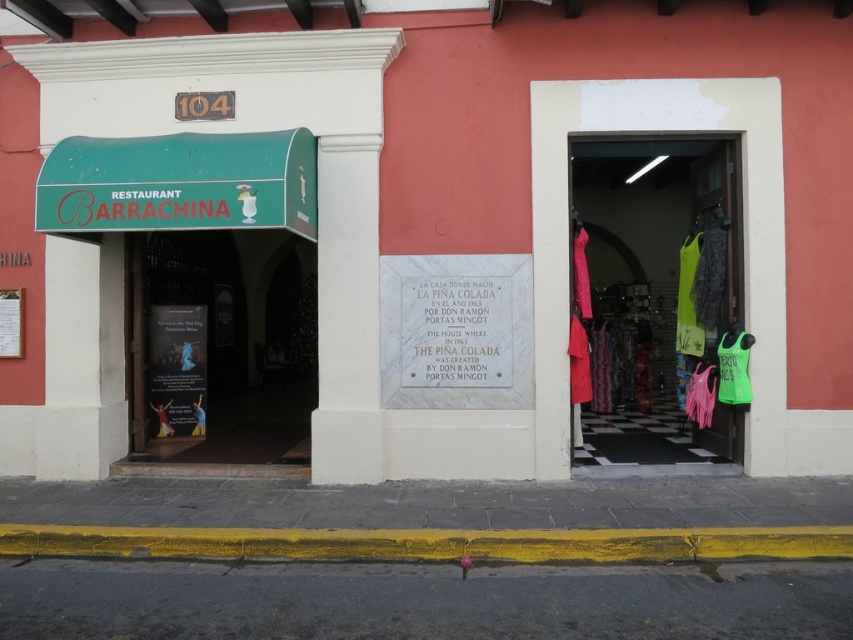
Question: Is neon green fabric at center closer to the viewer compared to matte paper poster at center?

Choices:
 (A) yes
 (B) no

Answer: (A)

Question: Is neon green fabric at center thinner than matte paper poster at center?

Choices:
 (A) yes
 (B) no

Answer: (B)

Question: Can you confirm if neon green fabric at center is smaller than matte paper poster at center?

Choices:
 (A) no
 (B) yes

Answer: (A)

Question: Which point appears closest to the camera in this image?

Choices:
 (A) (611, 458)
 (B) (154, 308)

Answer: (A)